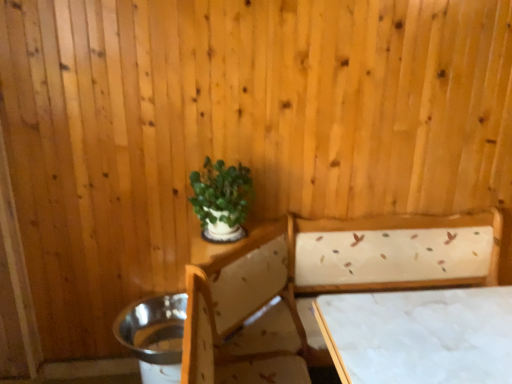
This screenshot has width=512, height=384. What do you see at coordinates (394, 252) in the screenshot?
I see `white fabric bed at center` at bounding box center [394, 252].

Where is `white fabric bed at center`? white fabric bed at center is located at coordinates (394, 252).

Does point (497, 230) come farther from viewer compared to point (232, 205)?

That is True.

Does white fabric bed at center appear on the left side of green matte plant at upper center?

No, white fabric bed at center is not to the left of green matte plant at upper center.

What's the angular difference between white fabric bed at center and green matte plant at upper center's facing directions?

The facing directions of white fabric bed at center and green matte plant at upper center are 90.8 degrees apart.

Is white fabric bed at center aimed at green matte plant at upper center?

No, white fabric bed at center is not oriented towards green matte plant at upper center.

Does white fabric-covered table at lower right touch white fabric bed at center?

No.

Is white fabric-covered table at lower right to the left or to the right of white fabric bed at center in the image?

Based on their positions, white fabric-covered table at lower right is located to the right of white fabric bed at center.

From the image's perspective, would you say white fabric-covered table at lower right is positioned over white fabric bed at center?

Yes, from the image's perspective, white fabric-covered table at lower right is above white fabric bed at center.

In the scene shown: Can you confirm if white fabric-covered table at lower right is wider than white fabric bed at center?

In fact, white fabric-covered table at lower right might be narrower than white fabric bed at center.

Based on the photo, from the image's perspective, is green matte plant at upper center below white fabric bed at center?

No, from the image's perspective, green matte plant at upper center is not below white fabric bed at center.

How much distance is there between green matte plant at upper center and white fabric bed at center?

green matte plant at upper center and white fabric bed at center are 24.41 inches apart.

Is green matte plant at upper center inside the boundaries of white fabric bed at center, or outside?

green matte plant at upper center is not enclosed by white fabric bed at center.

Is green matte plant at upper center looking in the opposite direction of white fabric bed at center?

That's not correct — green matte plant at upper center is not looking away from white fabric bed at center.

Who is smaller, white fabric-covered table at lower right or green matte plant at upper center?

Smaller between the two is green matte plant at upper center.

Is white fabric-covered table at lower right taller than green matte plant at upper center?

Yes.

Locate an element on the screen. table below the green matte plant at upper center (from the image's perspective) is located at coordinates (419, 335).

From a real-world perspective, is white fabric-covered table at lower right below green matte plant at upper center?

Yes.

Is green matte plant at upper center far away from white fabric-covered table at lower right?

That's not correct — green matte plant at upper center is a little close to white fabric-covered table at lower right.

Is point (202, 204) closer or farther from the camera than point (341, 304)?

Point (202, 204) is farther from the camera than point (341, 304).

Which object is wider, green matte plant at upper center or white fabric-covered table at lower right?

Wider between the two is white fabric-covered table at lower right.

Considering the relative positions of green matte plant at upper center and white fabric-covered table at lower right in the image provided, is green matte plant at upper center to the right of white fabric-covered table at lower right from the viewer's perspective?

No, green matte plant at upper center is not to the right of white fabric-covered table at lower right.

The width and height of the screenshot is (512, 384). I want to click on bed on the left of white fabric-covered table at lower right, so click(394, 252).

Is white fabric-covered table at lower right located within white fabric bed at center?

Yes, white fabric-covered table at lower right is a part of white fabric bed at center.

Looking at this image, does white fabric bed at center have a lesser height compared to white fabric-covered table at lower right?

No, white fabric bed at center is not shorter than white fabric-covered table at lower right.

What are the coordinates of `houseplant that is behind the white fabric bed at center` in the screenshot? It's located at (221, 200).

Find the location of a particular element. table located above the white fabric bed at center (from a real-world perspective) is located at coordinates (419, 335).

Based on their spatial positions, is green matte plant at upper center or white fabric bed at center closer to white fabric-covered table at lower right?

white fabric bed at center.

Based on their spatial positions, is white fabric-covered table at lower right or green matte plant at upper center further from white fabric bed at center?

green matte plant at upper center lies further to white fabric bed at center than the other object.

Estimate the real-world distances between objects in this image. Which object is further from white fabric-covered table at lower right, white fabric bed at center or green matte plant at upper center?

green matte plant at upper center lies further to white fabric-covered table at lower right than the other object.

Which object lies further to the anchor point green matte plant at upper center, white fabric-covered table at lower right or white fabric bed at center?

Among the two, white fabric-covered table at lower right is located further to green matte plant at upper center.

Which object lies further to the anchor point white fabric bed at center, green matte plant at upper center or white fabric-covered table at lower right?

green matte plant at upper center lies further to white fabric bed at center than the other object.

Which object lies nearer to the anchor point green matte plant at upper center, white fabric bed at center or white fabric-covered table at lower right?

The object closer to green matte plant at upper center is white fabric bed at center.

I want to click on bed between green matte plant at upper center and white fabric-covered table at lower right from left to right, so click(394, 252).